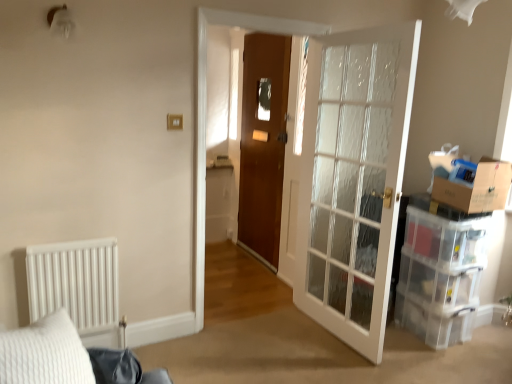
This screenshot has width=512, height=384. I want to click on vacant space in front of clear glass door at right, so click(320, 364).